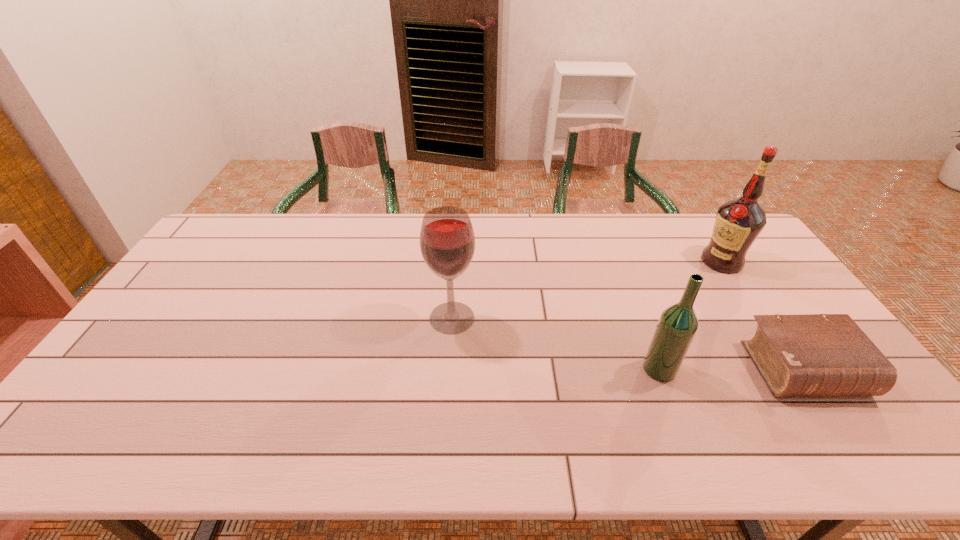
You are a GUI agent. You are given a task and a screenshot of the screen. Output one action in this format:
    pyautogui.click(x=<x>, y=<y>)
    Task: Click on the free space located 0.250m on the back of the third nearest object
    The height and width of the screenshot is (540, 960).
    Given the screenshot: What is the action you would take?
    pyautogui.click(x=456, y=251)

Locate an element on the screen. Image resolution: width=960 pixels, height=540 pixels. vacant position located 0.100m on the back of the nearest alcohol is located at coordinates (644, 329).

This screenshot has height=540, width=960. What are the coordinates of `vacant region located 0.140m on the spine side of the shortest object` in the screenshot? It's located at (864, 458).

Locate an element on the screen. This screenshot has height=540, width=960. object that is at the far edge is located at coordinates (738, 223).

The image size is (960, 540). I want to click on alcohol that is at the right edge, so click(x=738, y=223).

Image resolution: width=960 pixels, height=540 pixels. In order to click on Bible at the right edge in this screenshot , I will do `click(813, 355)`.

Identify the location of object located at the far right corner. The width and height of the screenshot is (960, 540). (738, 223).

I want to click on vacant space at the far edge of the desktop, so click(292, 244).

The height and width of the screenshot is (540, 960). I want to click on free space at the near edge of the desktop, so click(462, 446).

The image size is (960, 540). Identify the location of free region at the left edge. (215, 280).